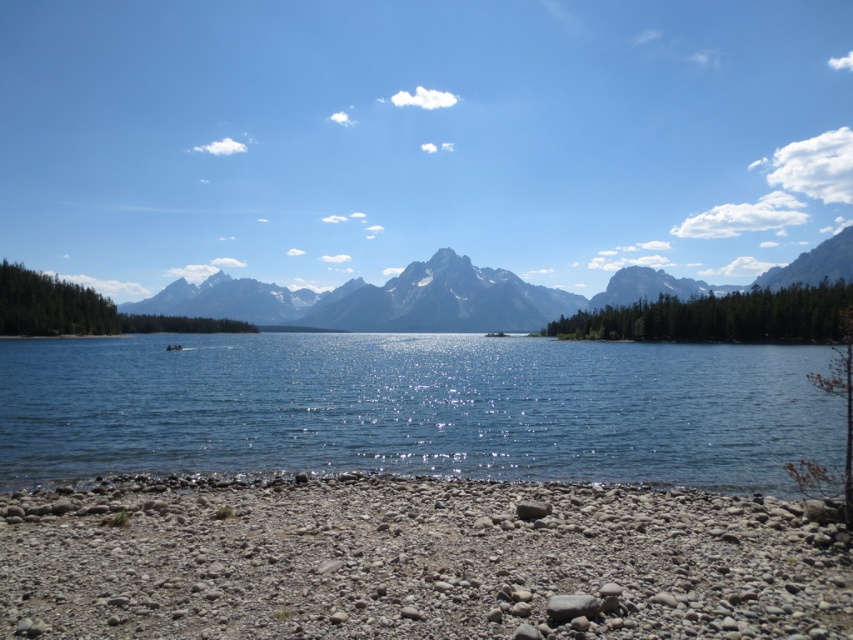
You are standing at the lakeside and want to pick up the gray gravel at lower center and the smooth gray rock at lower center. Which object will you reach first if you move forward from your current position?

The gray gravel at lower center will be reached first because it is closer to the viewer than the smooth gray rock at lower center.